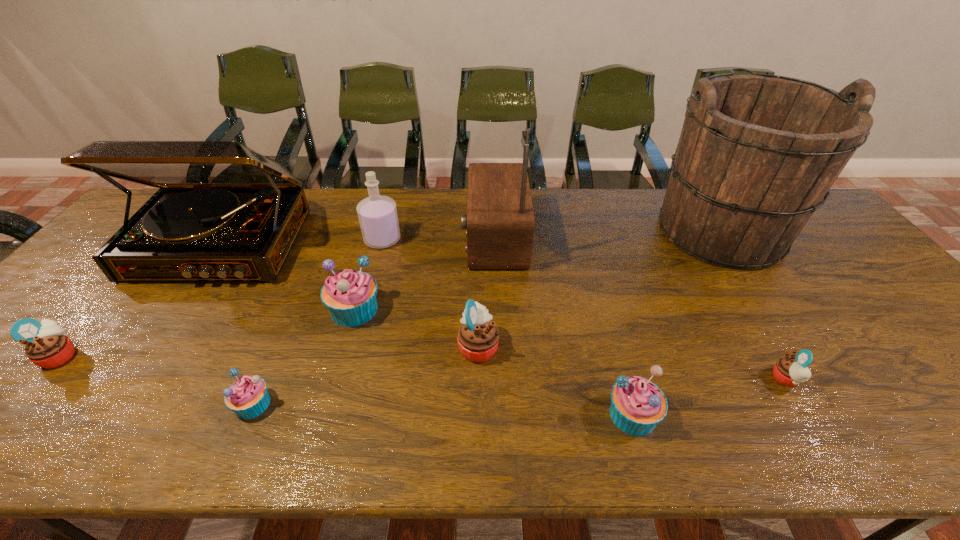
Image resolution: width=960 pixels, height=540 pixels. Find the location of `vacant region between the third tallest object and the second muffin from left to right`. vacant region between the third tallest object and the second muffin from left to right is located at coordinates (237, 325).

Identify the location of vacant area that lies between the smallest blue muffin and the radio receiver. (373, 321).

Locate an element on the screen. This screenshot has height=540, width=960. unoccupied area between the record player and the seventh shortest object is located at coordinates (301, 242).

I want to click on empty space between the second biggest pink muffin and the leftmost blue muffin, so click(x=156, y=380).

Locate an element on the screen. The height and width of the screenshot is (540, 960). object that stands as the eighth closest to the second biggest pink muffin is located at coordinates (757, 153).

Find the location of `object that is the closest to the record player`. object that is the closest to the record player is located at coordinates 350,296.

Identify the location of muffin that is the closest to the bucket. This screenshot has height=540, width=960. (790, 371).

Identify which muffin is located as the third nearest to the leftmost muffin. Please provide its 2D coordinates. Your answer should be formatted as a tuple, i.e. [(x, y)], where the tuple contains the x and y coordinates of a point satisfying the conditions above.

[(478, 337)]

Find the location of a particular element. Image resolution: width=960 pixels, height=540 pixels. the closest blue muffin relative to the leftmost blue muffin is located at coordinates (350, 296).

Identify which blue muffin is the second nearest to the radio receiver. Please provide its 2D coordinates. Your answer should be formatted as a tuple, i.e. [(x, y)], where the tuple contains the x and y coordinates of a point satisfying the conditions above.

[(637, 405)]